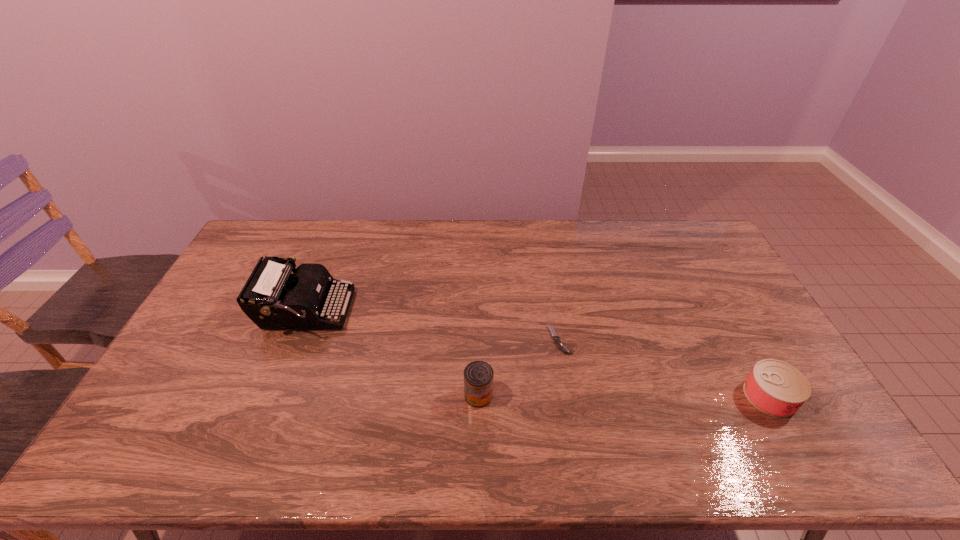
Where is `free space that satisfies the following two spatial constraints: 1. on the typing side of the pocketknife; 2. on the left side of the typewriter`? The width and height of the screenshot is (960, 540). free space that satisfies the following two spatial constraints: 1. on the typing side of the pocketknife; 2. on the left side of the typewriter is located at coordinates (294, 340).

Where is `vacant space that satisfies the following two spatial constraints: 1. on the typing side of the shorter can; 2. on the right side of the tallest object`? The image size is (960, 540). vacant space that satisfies the following two spatial constraints: 1. on the typing side of the shorter can; 2. on the right side of the tallest object is located at coordinates (271, 396).

What are the coordinates of `vacant region that satisfies the following two spatial constraints: 1. on the back side of the third tallest object; 2. on the typing side of the leftmost object` in the screenshot? It's located at pos(722,311).

Locate an element on the screen. This screenshot has height=540, width=960. free space that satisfies the following two spatial constraints: 1. on the typing side of the third object from left to right; 2. on the left side of the tallest object is located at coordinates (294, 340).

Identify the location of vacant region that satisfies the following two spatial constraints: 1. on the back side of the second object from right to left; 2. on the typing side of the tallest object. The height and width of the screenshot is (540, 960). 554,311.

Identify the location of vacant space that satisfies the following two spatial constraints: 1. on the typing side of the leftmost object; 2. on the back side of the taller can. (271, 395).

Locate an element on the screen. This screenshot has width=960, height=540. free space that satisfies the following two spatial constraints: 1. on the typing side of the typewriter; 2. on the back side of the second shortest object is located at coordinates (271, 396).

You are a GUI agent. You are given a task and a screenshot of the screen. Output one action in this format:
    pyautogui.click(x=<x>, y=<y>)
    Task: Click on the free spot that satisfies the following two spatial constraints: 1. on the typing side of the leftmost object; 2. on the back side of the right can
    
    Given the screenshot: What is the action you would take?
    pyautogui.click(x=271, y=396)